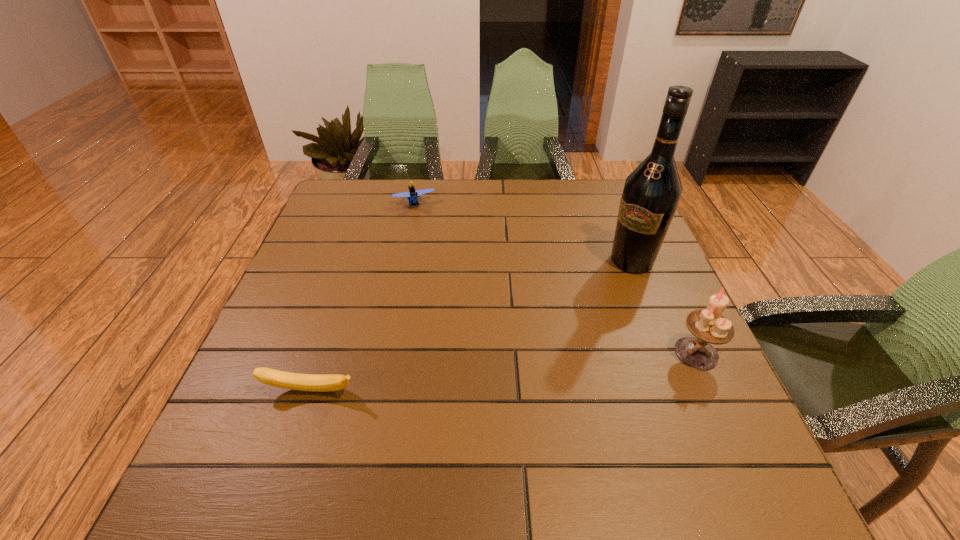
In order to click on vacant space at the far edge of the desktop in this screenshot , I will do `click(527, 213)`.

The width and height of the screenshot is (960, 540). In order to click on vacant space at the near edge of the desktop in this screenshot , I will do `click(348, 421)`.

You are a GUI agent. You are given a task and a screenshot of the screen. Output one action in this format:
    pyautogui.click(x=<x>, y=<y>)
    Task: Click on the vacant space at the left edge of the desktop
    The width and height of the screenshot is (960, 540).
    Given the screenshot: What is the action you would take?
    pyautogui.click(x=324, y=247)

This screenshot has height=540, width=960. Find the location of `vacant region at the right edge of the desktop`. vacant region at the right edge of the desktop is located at coordinates (616, 269).

Image resolution: width=960 pixels, height=540 pixels. In order to click on vacant space at the far left corner in this screenshot , I will do `click(343, 183)`.

The height and width of the screenshot is (540, 960). I want to click on vacant space at the near left corner of the desktop, so click(299, 438).

Find the location of `free space at the far right corner of the desktop`. free space at the far right corner of the desktop is located at coordinates (585, 199).

You are a GUI agent. You are given a task and a screenshot of the screen. Output one action in this format:
    pyautogui.click(x=<x>, y=<y>)
    Task: Click on the vacant space at the near right corner
    This screenshot has height=540, width=960.
    Given the screenshot: What is the action you would take?
    pyautogui.click(x=701, y=421)

This screenshot has height=540, width=960. What are the coordinates of `unoccupied position between the banana and the second nearest object` in the screenshot? It's located at (503, 372).

Identify the location of vacant space that is in between the farthest object and the second farthest object. This screenshot has width=960, height=540. (523, 232).